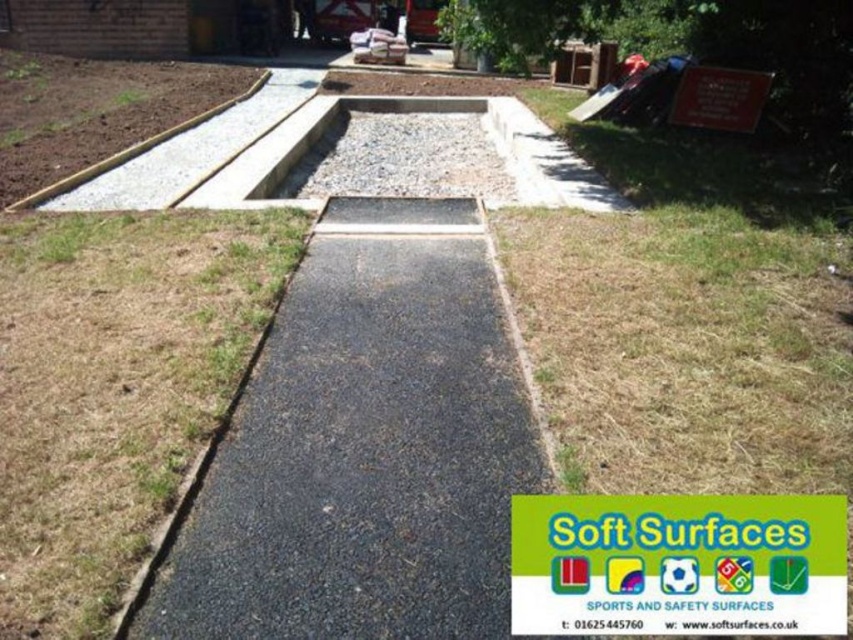
Question: Can you confirm if black asphalt pavement at center is bigger than dry grass at center?

Choices:
 (A) yes
 (B) no

Answer: (B)

Question: Is black asphalt pavement at center thinner than gray gravel at center?

Choices:
 (A) yes
 (B) no

Answer: (B)

Question: Estimate the real-world distances between objects in this image. Which object is farther from the black asphalt pavement at center?

Choices:
 (A) dry grass at center
 (B) gray gravel at center

Answer: (B)

Question: Observing the image, what is the correct spatial positioning of black asphalt pavement at center in reference to dry grass at center?

Choices:
 (A) right
 (B) left

Answer: (A)

Question: Which of the following is the closest to the observer?

Choices:
 (A) black asphalt pavement at center
 (B) dry grass at center

Answer: (B)

Question: Which of the following is the farthest from the observer?

Choices:
 (A) gray gravel at center
 (B) dry grass at center
 (C) black asphalt pavement at center

Answer: (A)